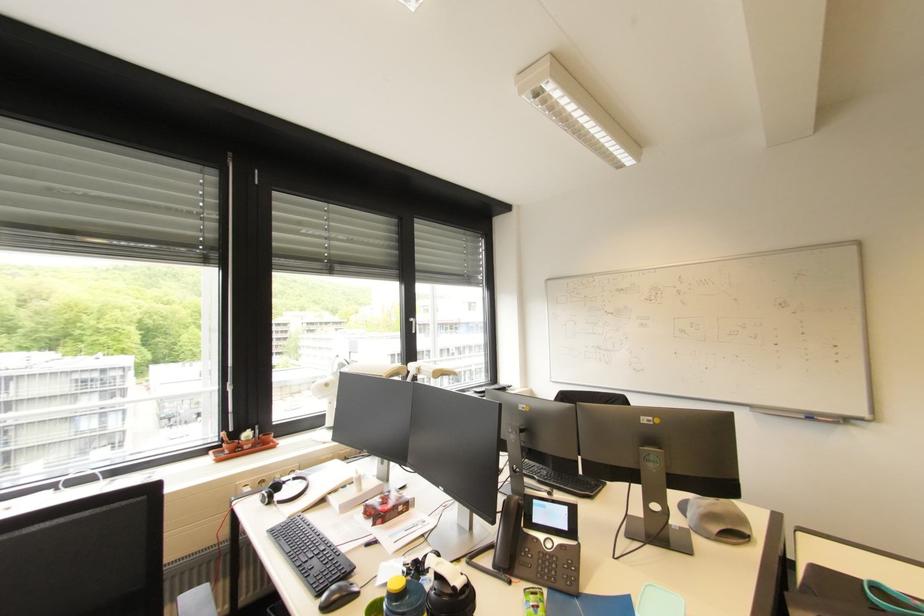
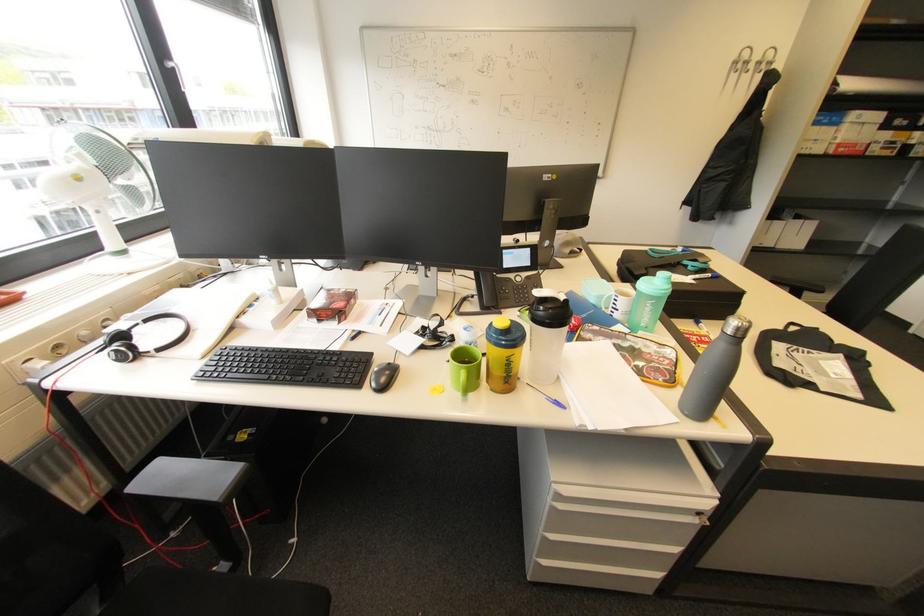
Locate, in the second image, the point that corresponds to (x=268, y=503) in the first image.

(127, 361)